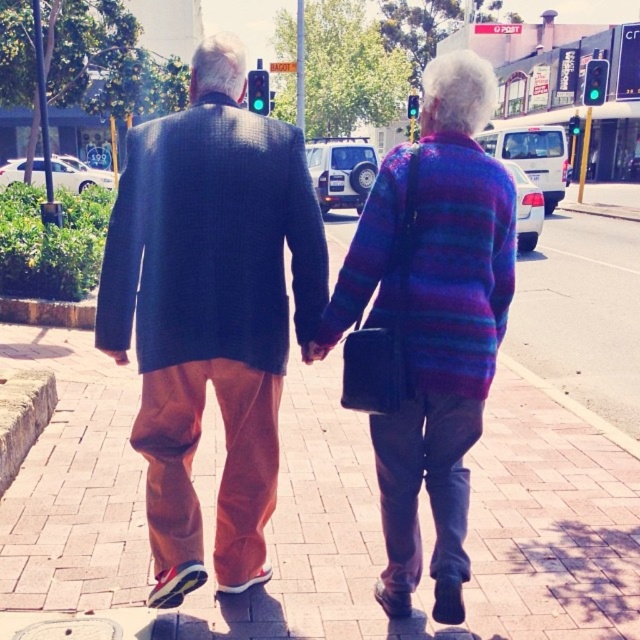
Question: Estimate the real-world distances between objects in this image. Which object is farther from the purple striped sweater at center?

Choices:
 (A) textured navy blazer at center
 (B) brick pavement at center

Answer: (B)

Question: Is brick pavement at center bigger than purple striped sweater at center?

Choices:
 (A) no
 (B) yes

Answer: (B)

Question: Is brick pavement at center above textured navy blazer at center?

Choices:
 (A) no
 (B) yes

Answer: (B)

Question: Which object is closer to the camera taking this photo?

Choices:
 (A) textured navy blazer at center
 (B) brick pavement at center
 (C) purple striped sweater at center

Answer: (A)

Question: In this image, where is brick pavement at center located relative to textured navy blazer at center?

Choices:
 (A) left
 (B) right

Answer: (B)

Question: Among these points, which one is nearest to the camera?

Choices:
 (A) tap(301, 214)
 (B) tap(445, 492)

Answer: (A)